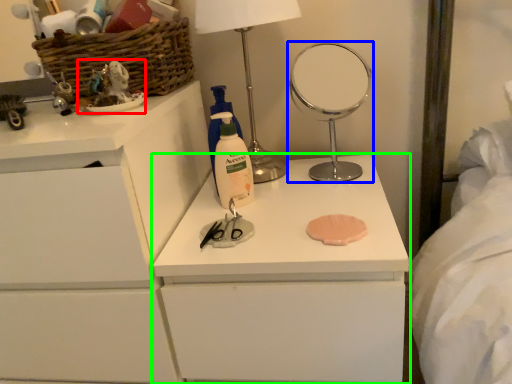
Question: Based on their relative distances, which object is nearer to toy (highlighted by a red box)? Choose from mirror (highlighted by a blue box) and chest of drawers (highlighted by a green box).

Choices:
 (A) mirror
 (B) chest of drawers

Answer: (B)